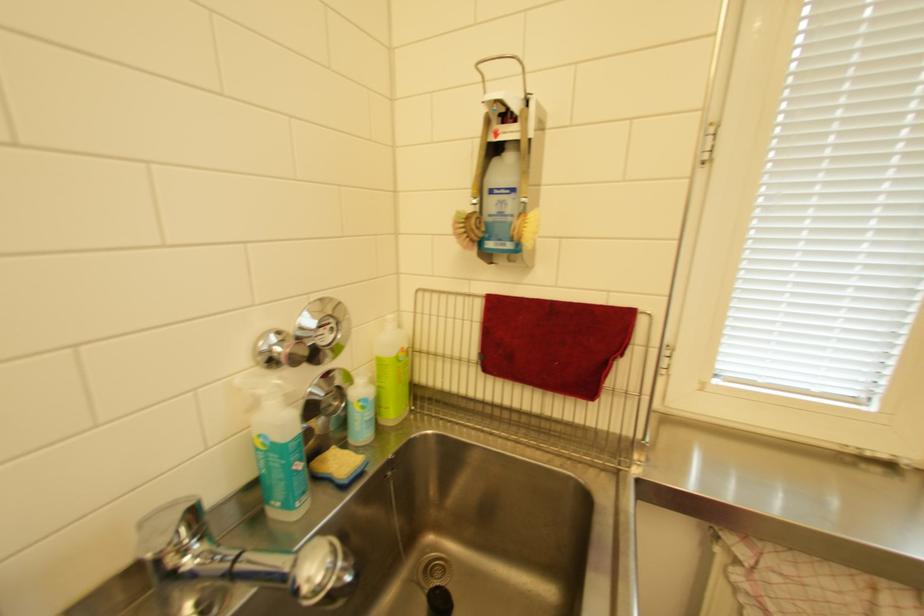
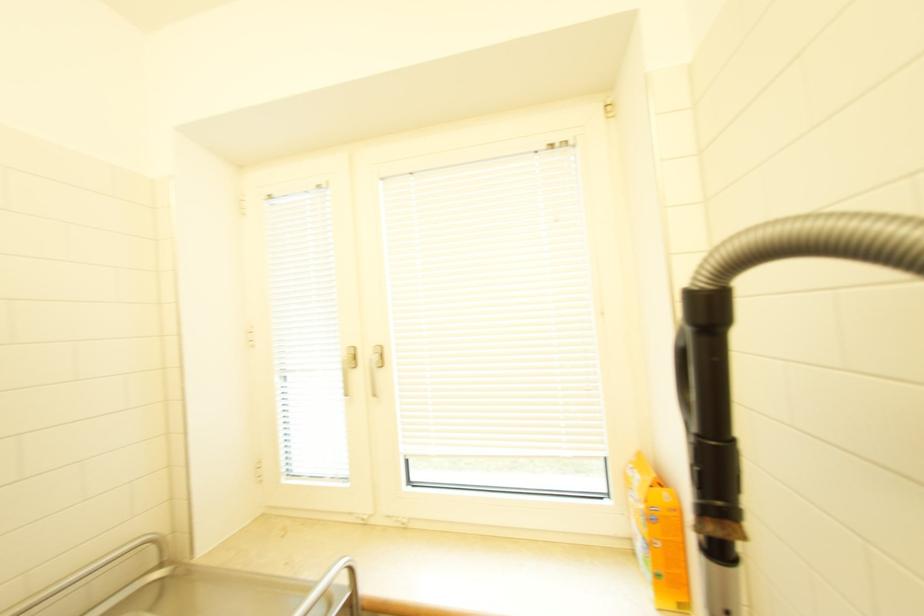
The images are taken continuously from a first-person perspective. In which direction are you moving?

The movement direction of the cameraman is left, forward.